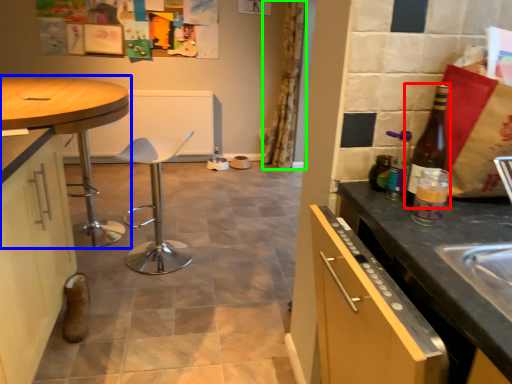
Question: Which is nearer to the bottle (highlighted by a red box)? table (highlighted by a blue box) or curtain (highlighted by a green box).

Choices:
 (A) table
 (B) curtain

Answer: (A)